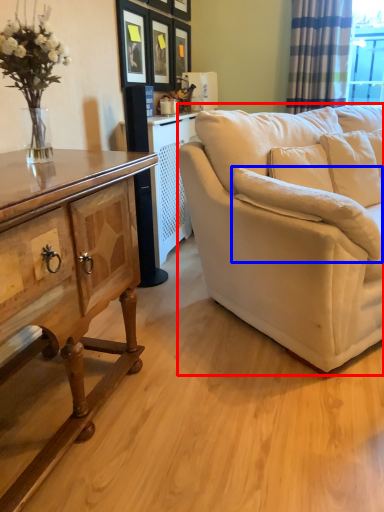
Question: Among these objects, which one is nearest to the camera, studio couch (highlighted by a red box) or pillow (highlighted by a blue box)?

Choices:
 (A) studio couch
 (B) pillow

Answer: (A)